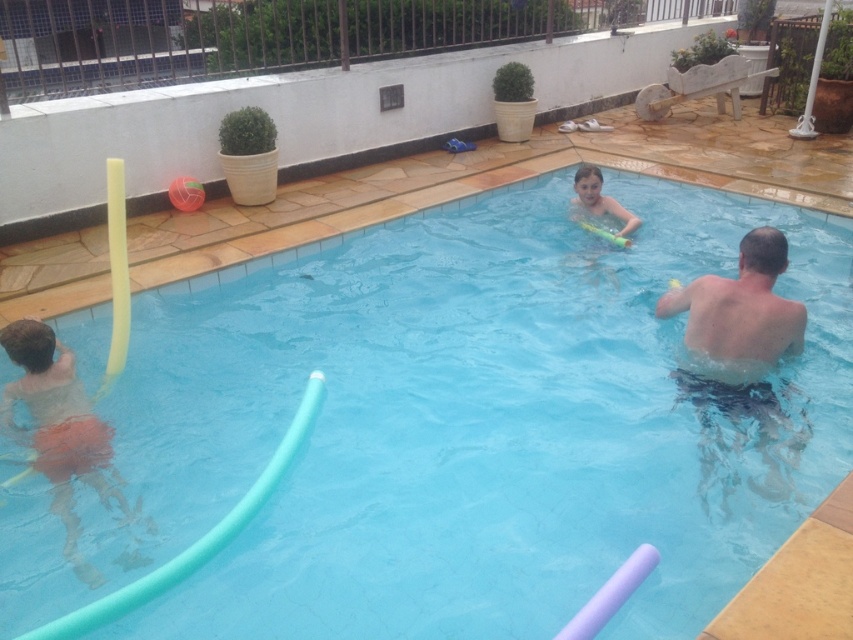
Question: Which point is closer to the camera?

Choices:
 (A) smooth yellow float at upper center
 (B) blue rubber pool float at lower left

Answer: (B)

Question: Is blue rubber pool float at lower left in front of matte orange shorts at left?

Choices:
 (A) no
 (B) yes

Answer: (B)

Question: Which is nearer to the smooth yellow float at upper center?

Choices:
 (A) blue rubber pool float at lower left
 (B) matte orange shorts at left
 (C) skinny blue shorts at right

Answer: (A)

Question: From the image, what is the correct spatial relationship of matte orange shorts at left in relation to smooth yellow float at upper center?

Choices:
 (A) below
 (B) above

Answer: (A)

Question: Which object appears closest to the camera in this image?

Choices:
 (A) smooth yellow float at upper center
 (B) skinny blue shorts at right

Answer: (B)

Question: Can you confirm if blue rubber pool float at lower left is positioned above matte orange shorts at left?

Choices:
 (A) no
 (B) yes

Answer: (B)